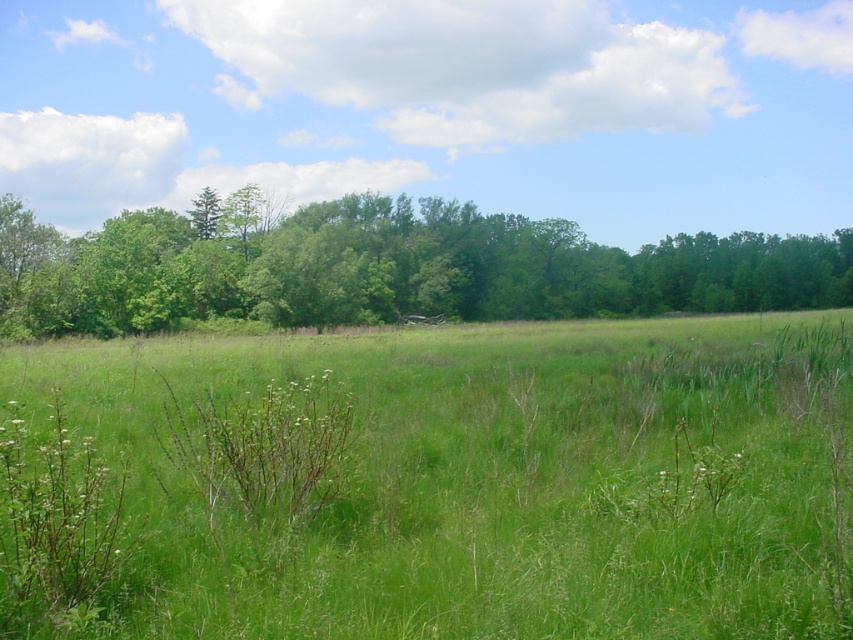
Question: Does green grassy field at center have a larger size compared to green leafy tree at center?

Choices:
 (A) no
 (B) yes

Answer: (A)

Question: Considering the relative positions of green grassy field at center and green leafy tree at center in the image provided, where is green grassy field at center located with respect to green leafy tree at center?

Choices:
 (A) above
 (B) below

Answer: (B)

Question: Does green grassy field at center appear over green leafy tree at center?

Choices:
 (A) yes
 (B) no

Answer: (B)

Question: Which object is closer to the camera taking this photo?

Choices:
 (A) green grassy field at center
 (B) green leafy tree at center

Answer: (A)